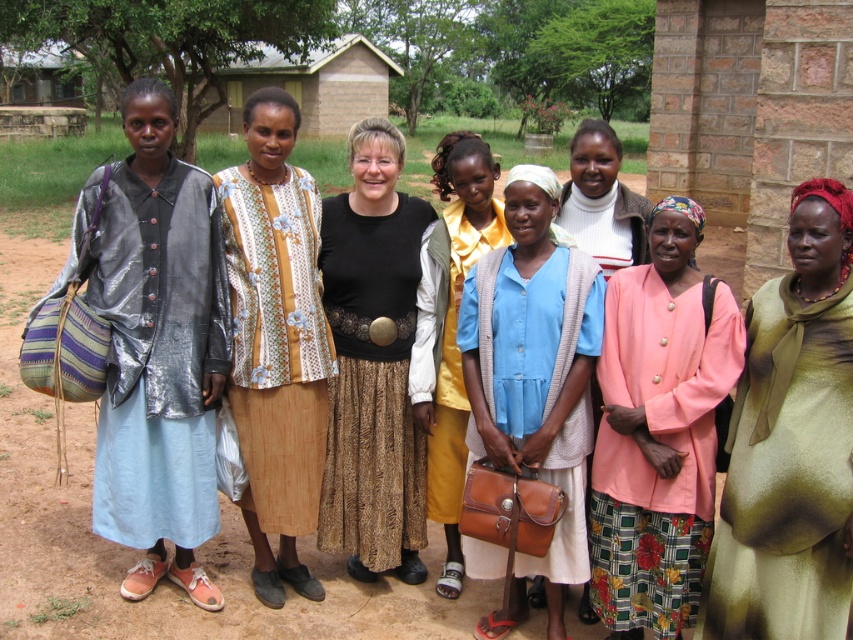
Question: Is shiny metallic jacket at left wider than pink fabric coat at center?

Choices:
 (A) yes
 (B) no

Answer: (A)

Question: Which object is farther from the camera taking this photo?

Choices:
 (A) black textured skirt at center
 (B) blue fabric shirt at center
 (C) shiny green dress at center
 (D) light blue denim shirt at center

Answer: (A)

Question: Which point is farther to the camera?

Choices:
 (A) (x=746, y=620)
 (B) (x=515, y=230)
 (C) (x=610, y=147)
 (D) (x=705, y=472)

Answer: (C)

Question: Is brown dirt field at center smaller than pink fabric coat at center?

Choices:
 (A) no
 (B) yes

Answer: (A)

Question: Is shiny green dress at center to the right of matte pink sweater at center from the viewer's perspective?

Choices:
 (A) yes
 (B) no

Answer: (A)

Question: Among these points, which one is nearest to the camera?

Choices:
 (A) (607, 186)
 (B) (186, 292)
 (C) (357, 145)

Answer: (B)